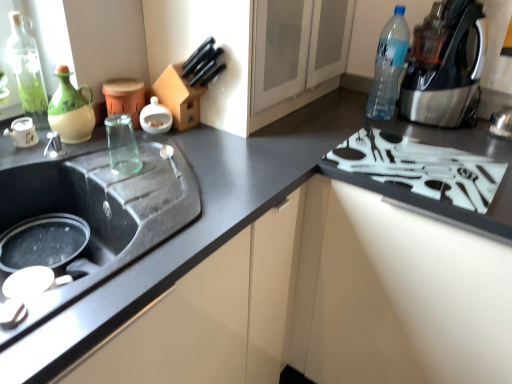
Locate an element on the screen. space that is in front of matte glass jar at upper left, acting as the 2th appliance starting from the right is located at coordinates (111, 153).